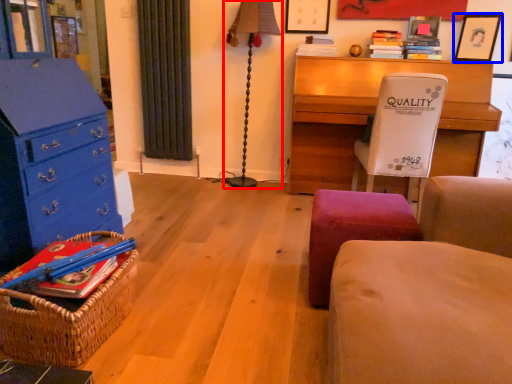
Question: Which of the following is the farthest to the observer, table lamp (highlighted by a red box) or picture frame (highlighted by a blue box)?

Choices:
 (A) table lamp
 (B) picture frame

Answer: (A)